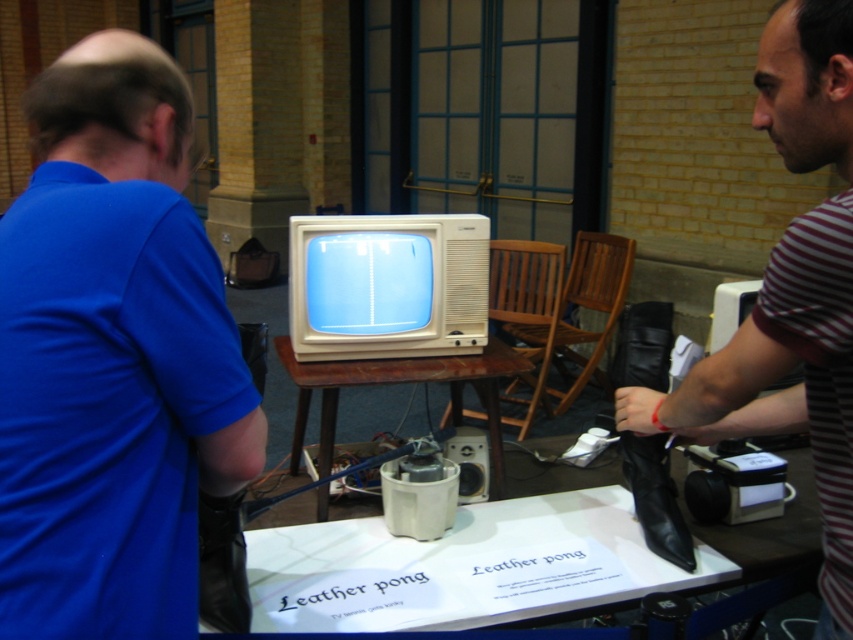
You are standing in front of the table with the leather pong setup. There are two points marked on the table surface at coordinates point (64,477) and point (279,339). Which of these points is closer to your viewpoint?

Point (64,477) is closer to the camera than point (279,339), so the point at (64,477) is closer to your viewpoint.

You are organizing an event and need to place a decorative item on the table. The blue matte shirt at left is smaller than the wooden table at center. Which object should you place first to ensure it fits properly?

The blue matte shirt at left should be placed first since it is smaller in size compared to the wooden table at center, ensuring it fits properly on the table.